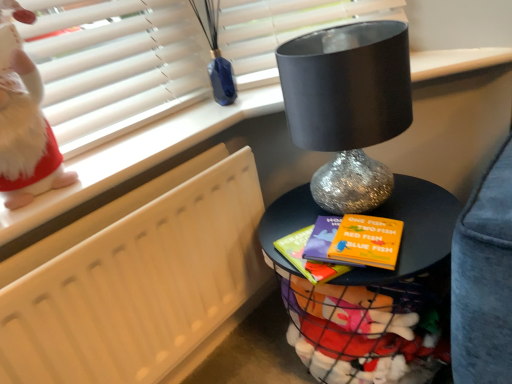
The height and width of the screenshot is (384, 512). I want to click on empty space that is ontop of shiny metallic table at center, so click(x=381, y=221).